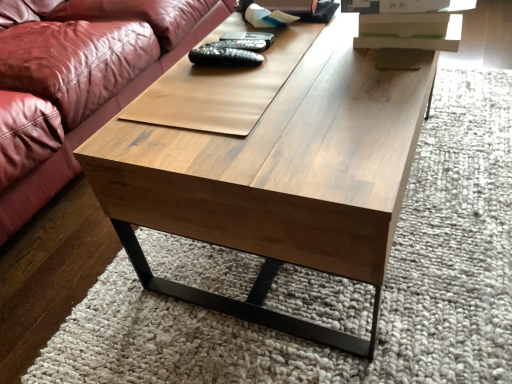
Locate an element on the screen. This screenshot has height=384, width=512. spots to the right of wooden coffee table at center is located at coordinates (463, 158).